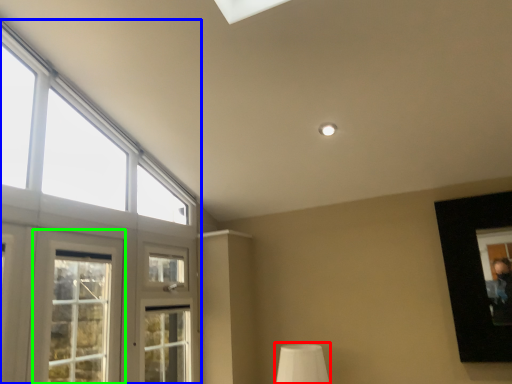
Question: Considering the real-world distances, which object is farthest from table lamp (highlighted by a red box)? window (highlighted by a blue box) or window (highlighted by a green box)?

Choices:
 (A) window
 (B) window

Answer: (B)